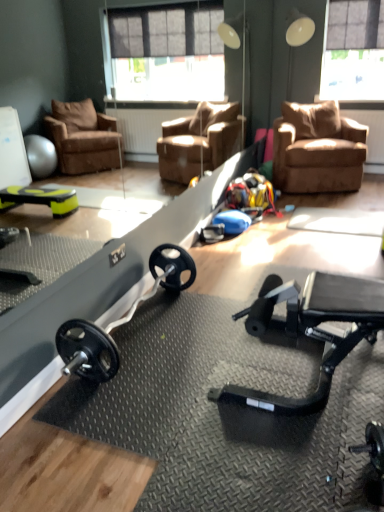
Question: Is translucent plastic window screen at upper right shorter than brown suede chair at upper right?

Choices:
 (A) no
 (B) yes

Answer: (A)

Question: Is translucent plastic window screen at upper right closer to the viewer compared to brown suede chair at upper right?

Choices:
 (A) no
 (B) yes

Answer: (A)

Question: From a real-world perspective, is translucent plastic window screen at upper right on brown suede chair at upper right?

Choices:
 (A) yes
 (B) no

Answer: (A)

Question: Are translucent plastic window screen at upper right and brown suede chair at upper right far apart?

Choices:
 (A) no
 (B) yes

Answer: (B)

Question: From the image's perspective, is translucent plastic window screen at upper right over brown suede chair at upper right?

Choices:
 (A) no
 (B) yes

Answer: (B)

Question: In terms of size, does brown suede chair at upper right appear bigger or smaller than translucent plastic window screen at upper right?

Choices:
 (A) big
 (B) small

Answer: (A)

Question: Does point (332, 112) appear closer or farther from the camera than point (327, 90)?

Choices:
 (A) farther
 (B) closer

Answer: (B)

Question: Would you say brown suede chair at upper right is to the left or to the right of translucent plastic window screen at upper right in the picture?

Choices:
 (A) left
 (B) right

Answer: (A)

Question: Is brown suede chair at upper right taller or shorter than translucent plastic window screen at upper right?

Choices:
 (A) short
 (B) tall

Answer: (A)

Question: Looking at their shapes, would you say black rubber barbell at center is wider or thinner than translucent plastic window screen at upper right?

Choices:
 (A) thin
 (B) wide

Answer: (B)

Question: From a real-world perspective, is black rubber barbell at center above or below translucent plastic window screen at upper right?

Choices:
 (A) above
 (B) below

Answer: (B)

Question: In terms of size, does black rubber barbell at center appear bigger or smaller than translucent plastic window screen at upper right?

Choices:
 (A) small
 (B) big

Answer: (B)

Question: Is black rubber barbell at center taller or shorter than translucent plastic window screen at upper right?

Choices:
 (A) tall
 (B) short

Answer: (B)

Question: From the image's perspective, is translucent plastic window screen at upper right positioned above or below brown suede chair at upper right?

Choices:
 (A) above
 (B) below

Answer: (A)

Question: Is point (347, 60) closer or farther from the camera than point (289, 181)?

Choices:
 (A) closer
 (B) farther

Answer: (B)